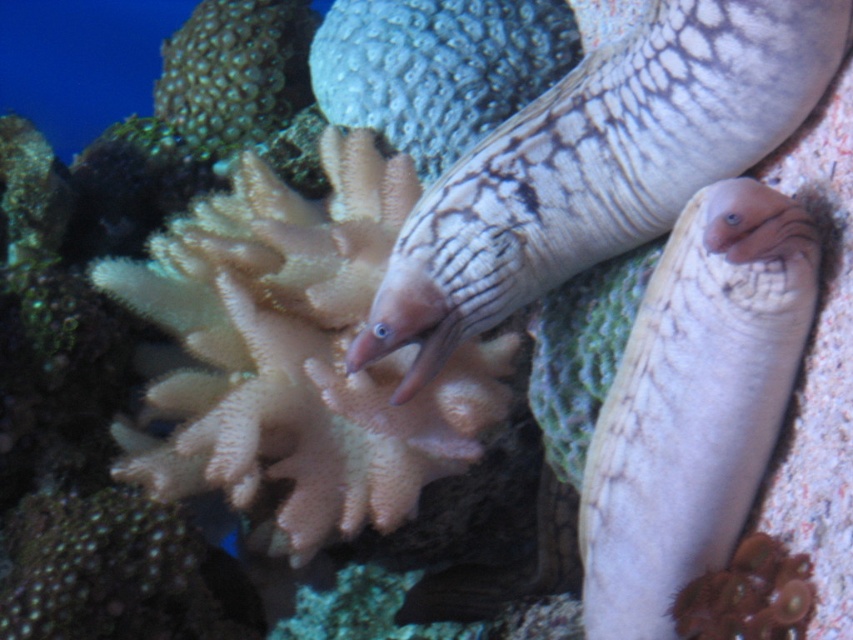
Question: Where is white matte coral at center located in relation to smooth beige eel at right in the image?

Choices:
 (A) right
 (B) left

Answer: (B)

Question: Which of the following is the closest to the observer?

Choices:
 (A) textured gray coral at center
 (B) green textured coral at upper left
 (C) speckled white eel at center

Answer: (C)

Question: Which point is closer to the camera taking this photo?

Choices:
 (A) (450, 241)
 (B) (244, 134)

Answer: (A)

Question: Which of the following is the farthest from the observer?

Choices:
 (A) textured gray coral at center
 (B) white matte coral at center
 (C) smooth beige eel at right
 (D) green textured coral at upper left

Answer: (D)

Question: Can you confirm if smooth beige eel at right is positioned above textured gray coral at center?

Choices:
 (A) yes
 (B) no

Answer: (B)

Question: Does speckled white eel at center come behind textured gray coral at center?

Choices:
 (A) yes
 (B) no

Answer: (B)